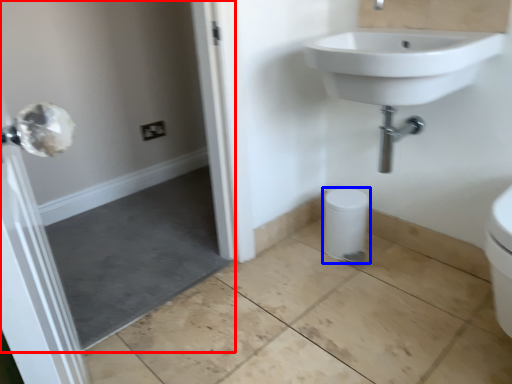
Question: Which object appears farthest to the camera in this image, screen door (highlighted by a red box) or bidet (highlighted by a blue box)?

Choices:
 (A) screen door
 (B) bidet

Answer: (B)